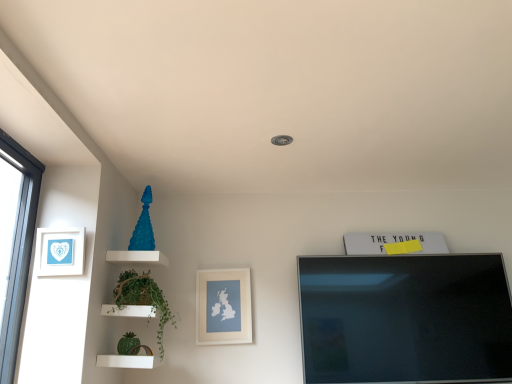
Question: Is green leafy plant at left inside or outside of white paper at left, the 2th picture frame in the right-to-left sequence?

Choices:
 (A) inside
 (B) outside

Answer: (B)

Question: Considering the positions of point (146, 273) and point (60, 264), is point (146, 273) closer or farther from the camera than point (60, 264)?

Choices:
 (A) closer
 (B) farther

Answer: (B)

Question: Based on their relative distances, which object is farther from the green leafy plant at left?

Choices:
 (A) white paper at left, which is the first picture frame in top-to-bottom order
 (B) matte white picture frame at center, the 1th picture frame in the back-to-front sequence

Answer: (B)

Question: Estimate the real-world distances between objects in this image. Which object is farther from the green leafy plant at left?

Choices:
 (A) white paper at left, which is the first picture frame in top-to-bottom order
 (B) matte white picture frame at center, which appears as the second picture frame when viewed from the left

Answer: (B)